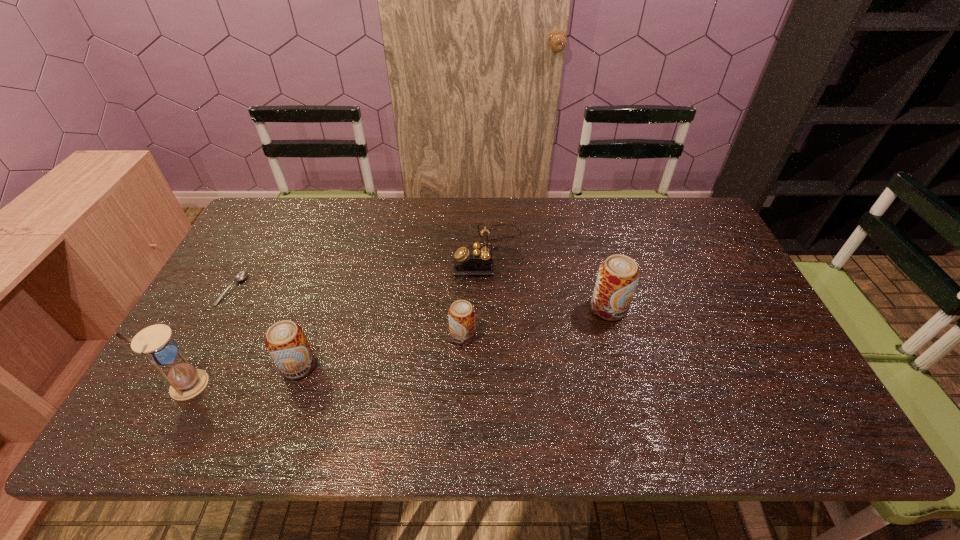
Image resolution: width=960 pixels, height=540 pixels. Find the location of `empty location between the soupspoon and the farthest beer can`. empty location between the soupspoon and the farthest beer can is located at coordinates (420, 299).

You are a GUI agent. You are given a task and a screenshot of the screen. Output one action in this format:
    pyautogui.click(x=<x>, y=<y>)
    Task: Click on the vacant area that lies between the shortest object and the second tallest object
    This screenshot has height=540, width=960.
    Given the screenshot: What is the action you would take?
    pyautogui.click(x=420, y=299)

Locate an element on the screen. This screenshot has height=540, width=960. empty location between the shortest beer can and the leftmost beer can is located at coordinates (381, 351).

Find the location of a particular element. The image size is (960, 540). vacant area that lies between the rightmost object and the telephone is located at coordinates (549, 280).

Identify the location of vacant point located between the third nearest object and the soupspoon. The height and width of the screenshot is (540, 960). (348, 313).

The image size is (960, 540). What are the coordinates of `vacant space in between the shortest object and the second beer can from left to right` in the screenshot? It's located at (348, 313).

This screenshot has height=540, width=960. Identify the location of free space that is in between the telephone and the rightmost beer can. (549, 280).

Point out which object is positioned as the third nearest to the telephone. Please provide its 2D coordinates. Your answer should be formatted as a tuple, i.e. [(x, y)], where the tuple contains the x and y coordinates of a point satisfying the conditions above.

[(286, 342)]

Select which object is the third closest to the tallest object. Please provide its 2D coordinates. Your answer should be formatted as a tuple, i.e. [(x, y)], where the tuple contains the x and y coordinates of a point satisfying the conditions above.

[(461, 314)]

Choose which beer can is the second nearest neighbor to the third object from left to right. Please provide its 2D coordinates. Your answer should be formatted as a tuple, i.e. [(x, y)], where the tuple contains the x and y coordinates of a point satisfying the conditions above.

[(618, 275)]